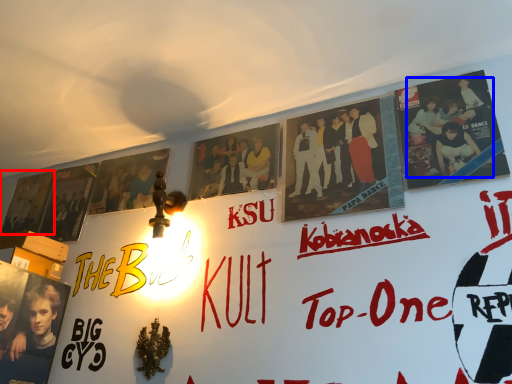
Question: Which object is closer to the camera taking this photo, movie poster (highlighted by a red box) or person (highlighted by a blue box)?

Choices:
 (A) movie poster
 (B) person

Answer: (B)